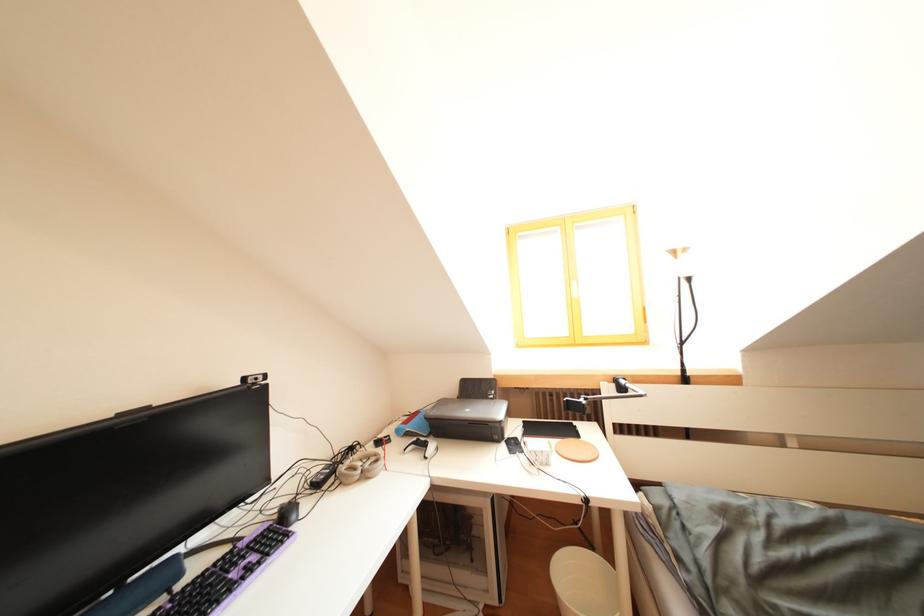
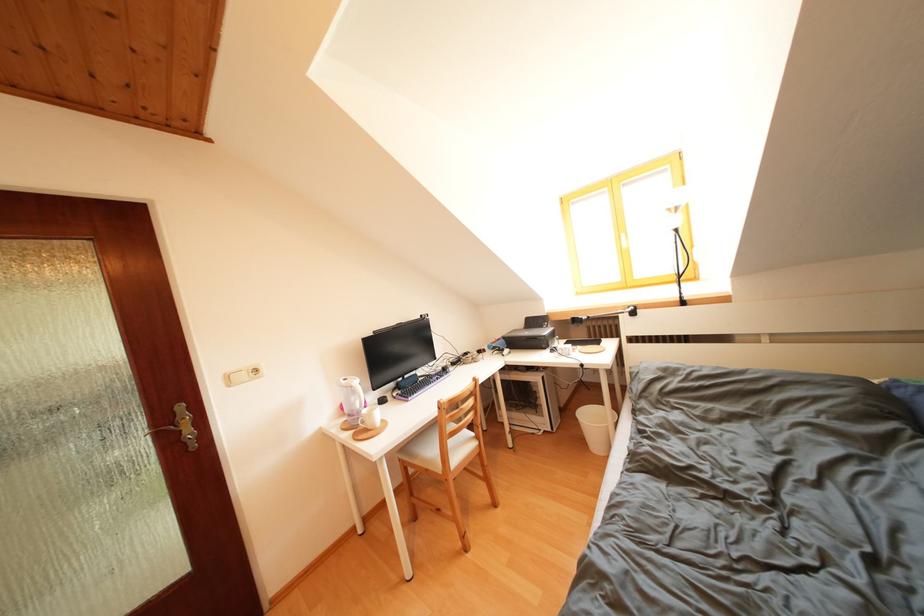
Question: The camera is either moving clockwise (left) or counter-clockwise (right) around the object. The first image is from the beginning of the video and the second image is from the end. Is the camera moving left or right when shooting the video?

Choices:
 (A) Left
 (B) Right

Answer: (B)